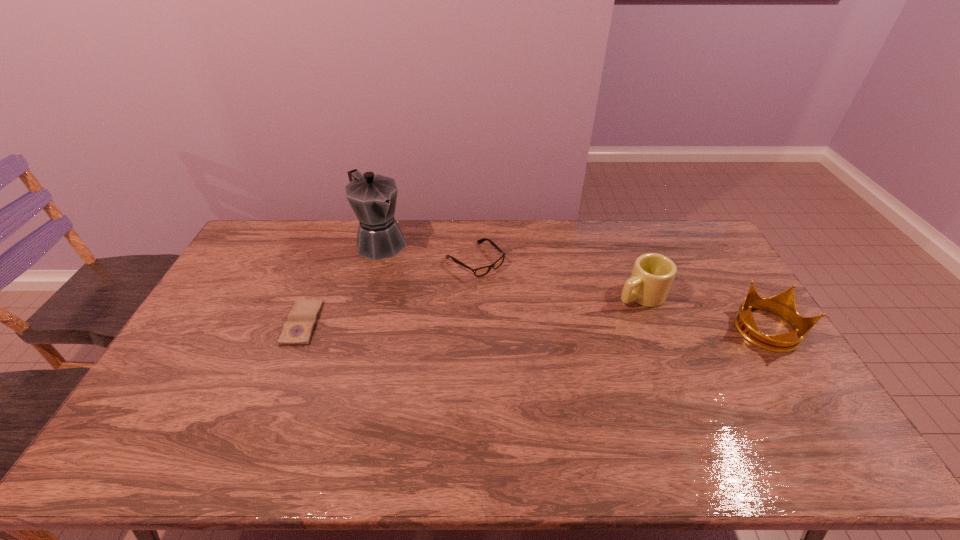
Identify the location of unoccupied area between the rightmost object and the second shortest object. (620, 295).

Locate an element on the screen. The height and width of the screenshot is (540, 960). unoccupied position between the rightmost object and the fourth tallest object is located at coordinates (620, 295).

At what (x,y) coordinates should I click in order to perform the action: click on vacant area that lies between the mug and the diary. Please return your answer as a coordinate pair (x, y). Image resolution: width=960 pixels, height=540 pixels. Looking at the image, I should click on (471, 309).

At what (x,y) coordinates should I click in order to perform the action: click on blank region between the crown and the mug. Please return your answer as a coordinate pair (x, y). Looking at the image, I should click on (704, 313).

I want to click on vacant region between the leftmost object and the tallest object, so click(342, 282).

Image resolution: width=960 pixels, height=540 pixels. I want to click on free space between the fourth tallest object and the crown, so click(x=620, y=295).

Identify the location of vacant area between the rightmost object and the coffeepot. Image resolution: width=960 pixels, height=540 pixels. (573, 286).

At what (x,y) coordinates should I click in order to perform the action: click on object that is the fourth closest one to the shortest object. Please return your answer as a coordinate pair (x, y). The height and width of the screenshot is (540, 960). Looking at the image, I should click on (783, 304).

Where is `object that is the third closest to the second object from right to left`? This screenshot has height=540, width=960. object that is the third closest to the second object from right to left is located at coordinates (372, 197).

The image size is (960, 540). I want to click on vacant area that satisfies the following two spatial constraints: 1. on the front side of the mug; 2. on the right side of the crown, so click(655, 330).